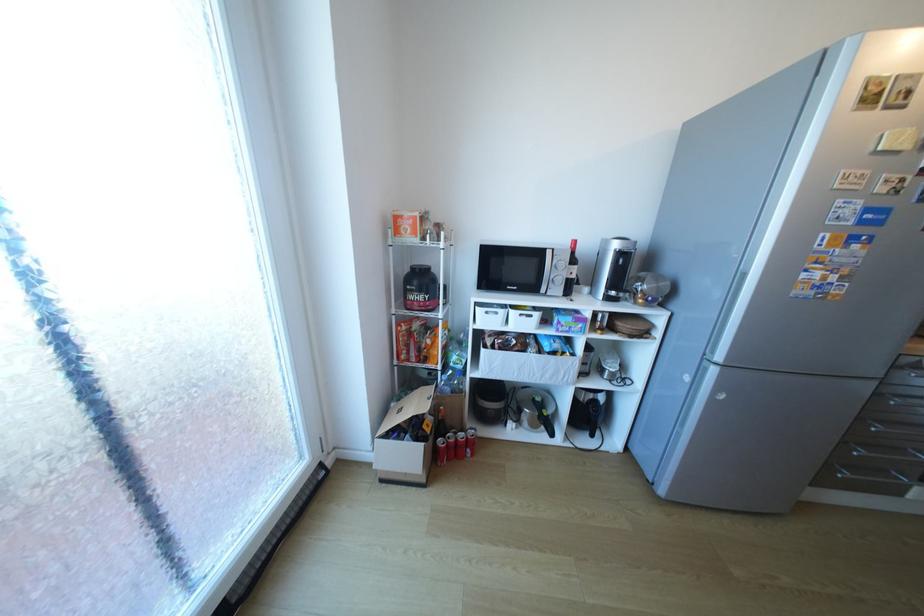
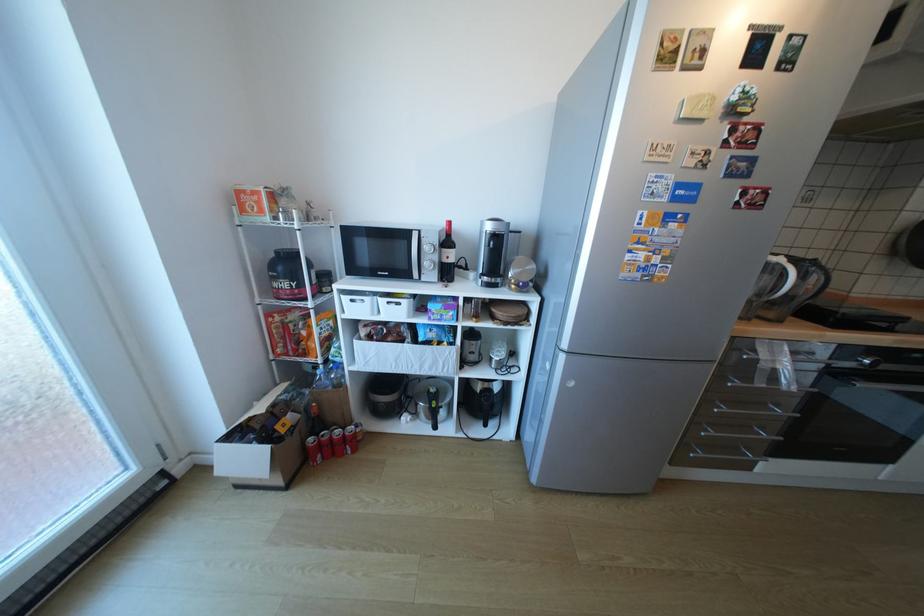
Question: The images are taken continuously from a first-person perspective. In which direction are you moving?

Choices:
 (A) Left
 (B) Right
 (C) Forward
 (D) Backward

Answer: (B)